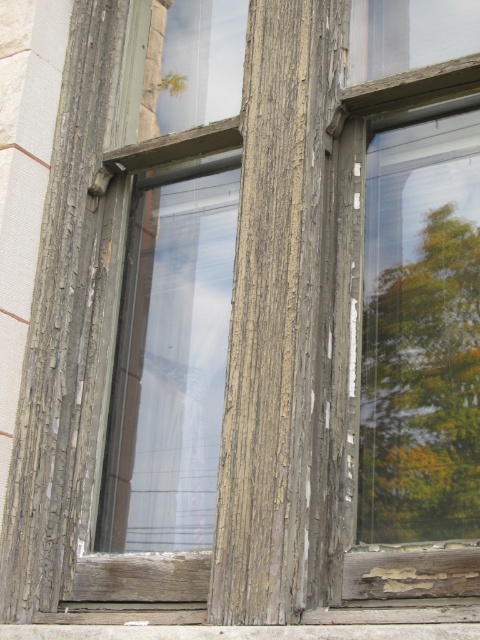
Question: Among these objects, which one is farthest from the camera?

Choices:
 (A) wooden plank at lower center
 (B) green leafy tree at right

Answer: (B)

Question: Does green leafy tree at right have a smaller size compared to wooden plank at lower center?

Choices:
 (A) no
 (B) yes

Answer: (B)

Question: Which point is farther to the camera?

Choices:
 (A) (322, 634)
 (B) (444, 205)

Answer: (B)

Question: Which object appears farthest from the camera in this image?

Choices:
 (A) wooden plank at lower center
 (B) green leafy tree at right

Answer: (B)

Question: Does green leafy tree at right appear on the left side of wooden plank at lower center?

Choices:
 (A) yes
 (B) no

Answer: (B)

Question: Is green leafy tree at right to the left of wooden plank at lower center from the viewer's perspective?

Choices:
 (A) no
 (B) yes

Answer: (A)